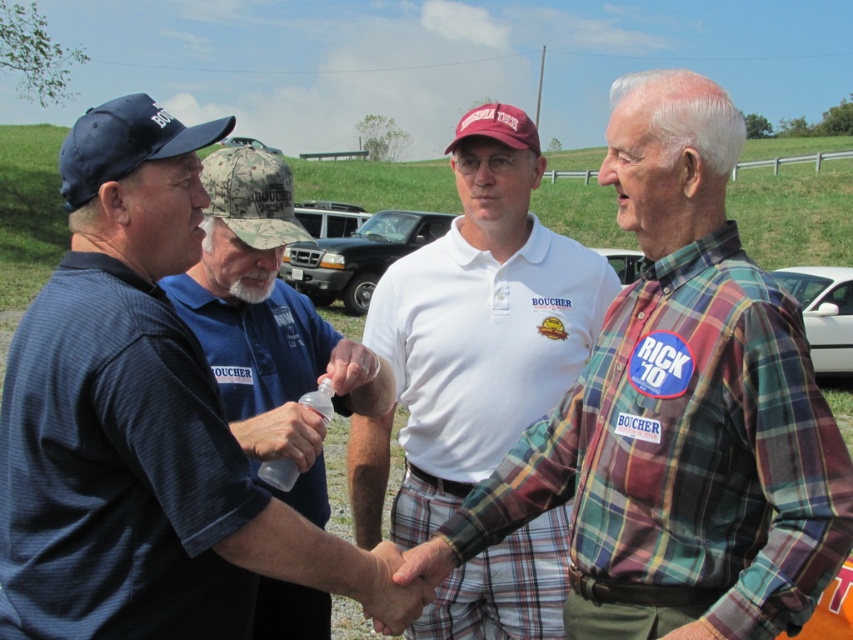
Question: Which point appears farthest from the camera in this image?

Choices:
 (A) (807, 336)
 (B) (610, 259)
 (C) (428, 515)

Answer: (B)

Question: Estimate the real-world distances between objects in this image. Which object is closer to the white plastic car at center?

Choices:
 (A) blue striped shirt at left
 (B) white cotton polo shirt at center

Answer: (B)

Question: Which of these objects is positioned farthest from the white glossy car at right?

Choices:
 (A) blue striped shirt at left
 (B) white cotton polo shirt at center

Answer: (A)

Question: Does white cotton polo shirt at center appear under white glossy car at right?

Choices:
 (A) no
 (B) yes

Answer: (B)

Question: Considering the relative positions of white glossy car at right and metallic silver car at upper center in the image provided, where is white glossy car at right located with respect to metallic silver car at upper center?

Choices:
 (A) left
 (B) right

Answer: (B)

Question: From the image, what is the correct spatial relationship of white cotton shirt at center in relation to black matte truck at center?

Choices:
 (A) above
 (B) below

Answer: (B)